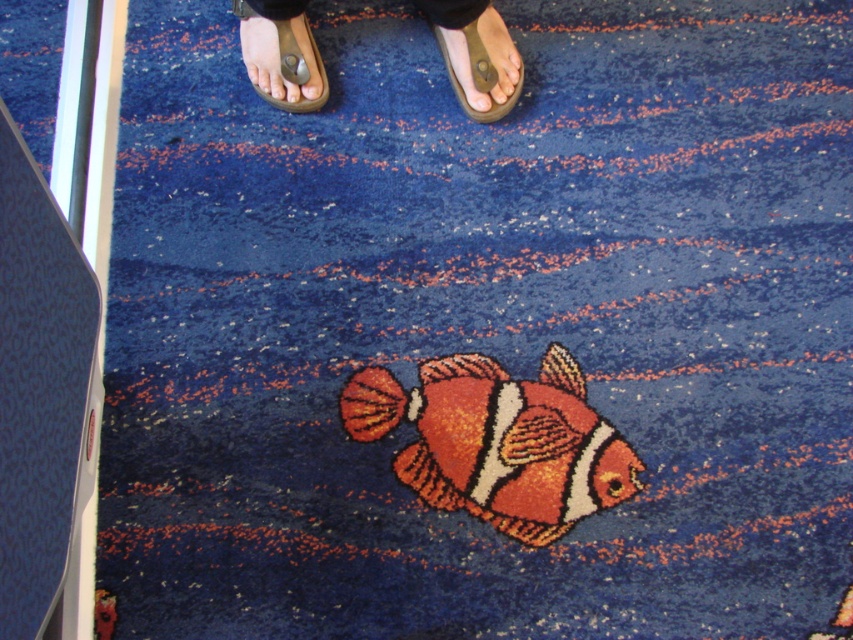
You are a person standing on the carpeted floor with the brown leather sandals at upper center and the brown leather sandal at upper center. Which one of your feet is wearing the larger footwear?

The brown leather sandals at upper center is bigger than the brown leather sandal at upper center, so the foot wearing the brown leather sandals at upper center has the larger footwear.

You are standing on the carpeted floor and see the point marked at coordinates (498, 442). What object is located at that point?

The point at coordinates (498, 442) indicates the orange felt clown fish at center.

You are designing a shoe rack and need to know which of the two items at the upper center is wider. Which one is wider between the brown leather sandals at upper center and the brown leather sandal at upper center?

The brown leather sandals at upper center is wider than the brown leather sandal at upper center according to the description.